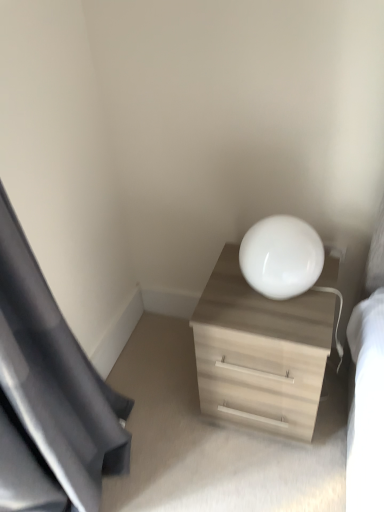
You are a GUI agent. You are given a task and a screenshot of the screen. Output one action in this format:
    pyautogui.click(x=<x>, y=<y>)
    Task: Click on the free point above white glossy lampshade at upper right (from a real-world perspective)
    This screenshot has width=384, height=512.
    Given the screenshot: What is the action you would take?
    pyautogui.click(x=279, y=226)